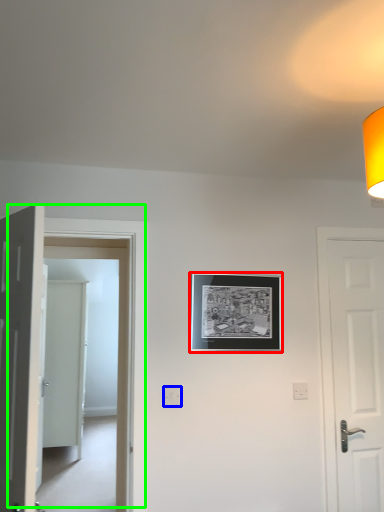
Question: Based on their relative distances, which object is nearer to picture frame (highlighted by a red box)? Choose from electric outlet (highlighted by a blue box) and door (highlighted by a green box).

Choices:
 (A) electric outlet
 (B) door

Answer: (B)